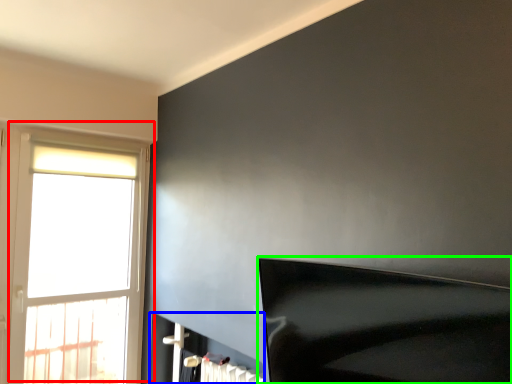
Question: Based on their relative distances, which object is farther from window (highlighted by a red box)? Choose from fireplace (highlighted by a blue box) and furniture (highlighted by a green box).

Choices:
 (A) fireplace
 (B) furniture

Answer: (B)